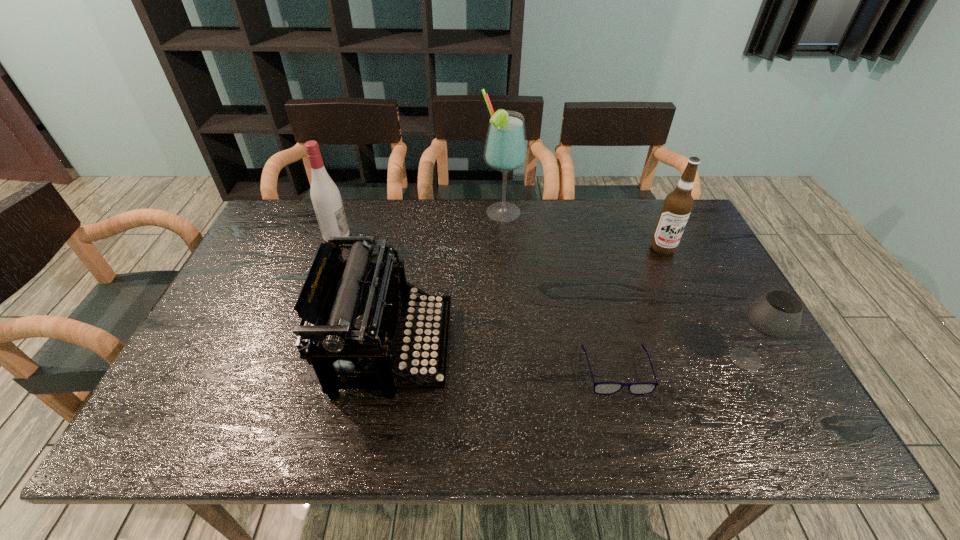
The height and width of the screenshot is (540, 960). What are the coordinates of `free region that satisfies the following two spatial constraints: 1. on the label of the leftmost object; 2. on the right side of the wineglass` in the screenshot? It's located at (291, 359).

Locate an element on the screen. free location that satisfies the following two spatial constraints: 1. on the typing side of the third shortest object; 2. on the left side of the fifth tallest object is located at coordinates (390, 359).

What are the coordinates of `vacant region that satisfies the following two spatial constraints: 1. on the label of the leftmost alcohol; 2. on the right side of the second shortest object` in the screenshot? It's located at (291, 359).